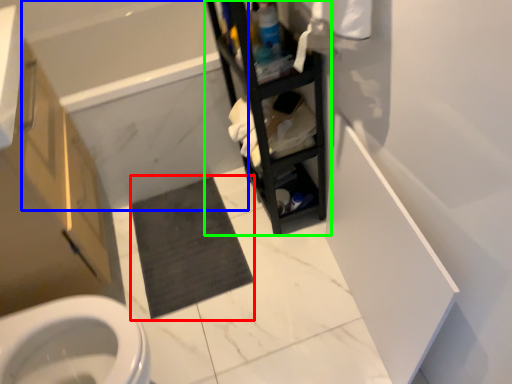
Question: Estimate the real-world distances between objects in this image. Which object is farther from bath mat (highlighted by a red box), bath (highlighted by a blue box) or shelf (highlighted by a green box)?

Choices:
 (A) bath
 (B) shelf

Answer: (B)